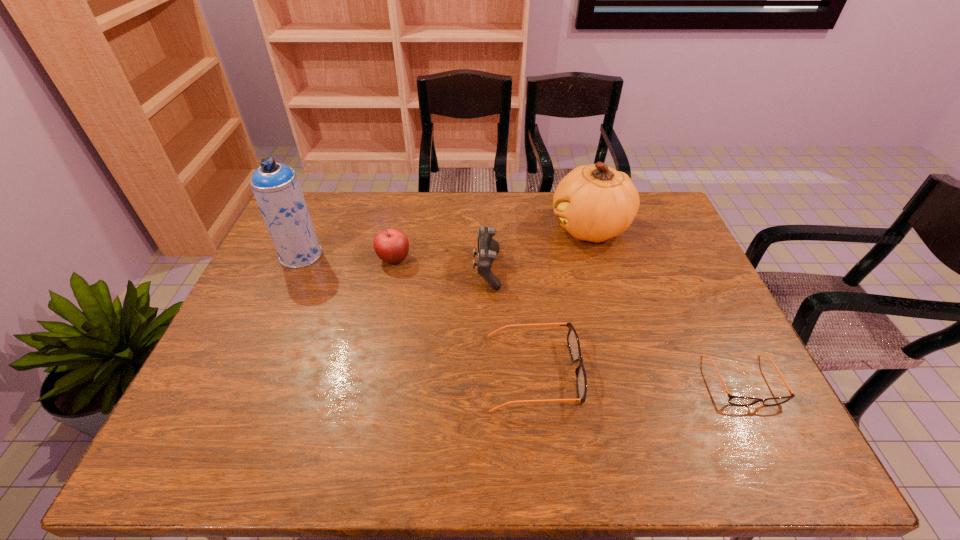
The width and height of the screenshot is (960, 540). Identify the location of free space located 0.230m on the back of the leftmost object. (324, 202).

Identify the location of vacant space situated 0.050m on the front face of the pumpkin. (535, 228).

Where is `blank space located on the front face of the pumpkin`? The width and height of the screenshot is (960, 540). blank space located on the front face of the pumpkin is located at coordinates (473, 228).

Locate an element on the screen. The width and height of the screenshot is (960, 540). vacant space situated on the front face of the pumpkin is located at coordinates [x=458, y=228].

Find the location of a particular element. This screenshot has width=960, height=540. free spot located on the left of the fifth object from right to left is located at coordinates 313,259.

This screenshot has width=960, height=540. Identify the location of vacant region located on the surface of the control with buttons. (400, 271).

This screenshot has height=540, width=960. Identify the location of vacant space positioned on the surface of the control with buttons. (444, 271).

The image size is (960, 540). What are the coordinates of `vacant point located 0.150m on the surface of the control with buttons` in the screenshot? It's located at (423, 271).

I want to click on object at the far edge, so click(595, 202).

I want to click on object positioned at the left edge, so click(276, 187).